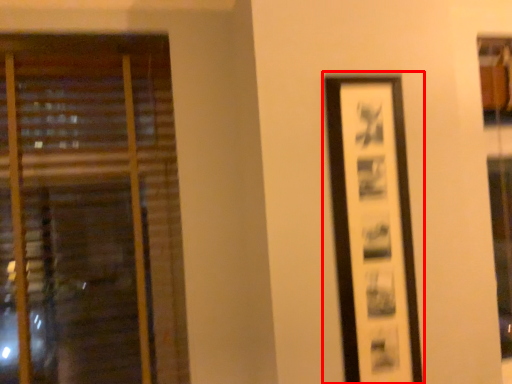
Question: Where is picture frame (annotated by the red box) located in relation to window in the image?

Choices:
 (A) right
 (B) left

Answer: (A)